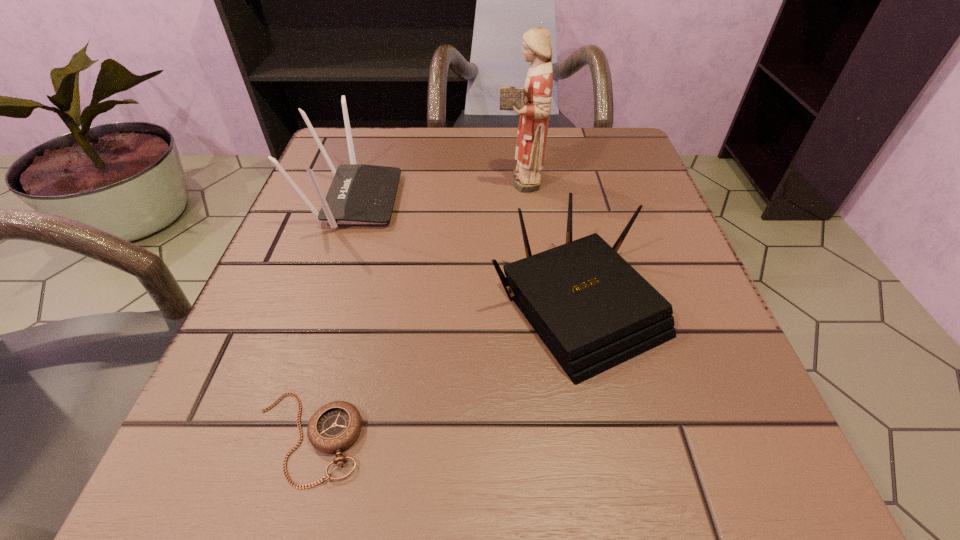
Find the location of a particular element. This screenshot has width=960, height=540. the tallest object is located at coordinates (532, 102).

Where is `the taller router`? The height and width of the screenshot is (540, 960). the taller router is located at coordinates (359, 194).

The image size is (960, 540). Identify the location of the third shortest object. (359, 194).

Image resolution: width=960 pixels, height=540 pixels. What are the coordinates of `the second nearest object` in the screenshot? It's located at (593, 311).

Where is `the shorter router`? The width and height of the screenshot is (960, 540). the shorter router is located at coordinates (593, 311).

The image size is (960, 540). Identify the location of the shortest object. (335, 426).

At what (x,y) coordinates should I click in order to perform the action: click on the nearest object. Please return your answer as a coordinate pair (x, y). Image resolution: width=960 pixels, height=540 pixels. Looking at the image, I should click on pyautogui.click(x=335, y=426).

This screenshot has width=960, height=540. I want to click on vacant space located on the front-facing side of the tallest object, so click(x=421, y=180).

Find the location of a particular element. blank space located 0.080m on the front-facing side of the tallest object is located at coordinates (456, 180).

In order to click on free spot located on the front-facing side of the tallest object in this screenshot , I will do `click(310, 180)`.